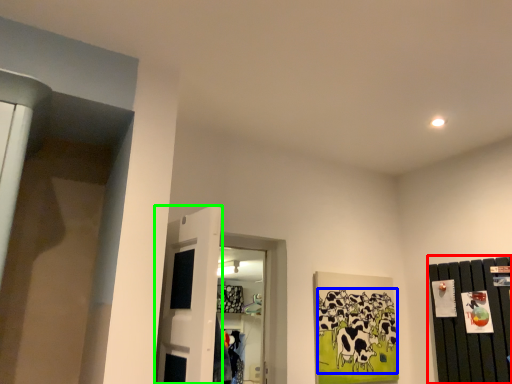
Question: Which object is positioned closest to dresser (highlighted by a red box)? Select from animal (highlighted by a blue box) and door (highlighted by a green box).

Choices:
 (A) animal
 (B) door

Answer: (A)